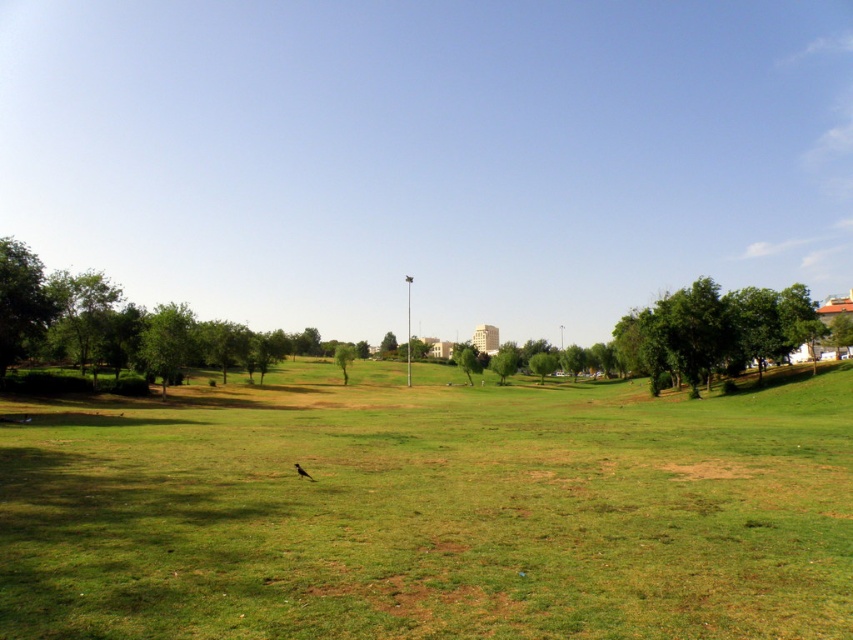
Question: Which is nearer to the brown feathered bird at center?

Choices:
 (A) green leafy tree at left
 (B) green leafy tree at center
 (C) green grass at center

Answer: (C)

Question: Based on their relative distances, which object is farther from the brown feathered bird at center?

Choices:
 (A) green leafy tree at left
 (B) green grass at center

Answer: (A)

Question: Can you confirm if green leafy tree at center is positioned to the right of brown feathered bird at center?

Choices:
 (A) no
 (B) yes

Answer: (A)

Question: Is green leafy tree at left smaller than brown feathered bird at center?

Choices:
 (A) yes
 (B) no

Answer: (B)

Question: Which of the following is the closest to the observer?

Choices:
 (A) brown feathered bird at center
 (B) green leafy tree at center
 (C) green grass at center
 (D) green leafy tree at left

Answer: (C)

Question: Is green leafy tree at left positioned before brown feathered bird at center?

Choices:
 (A) yes
 (B) no

Answer: (B)